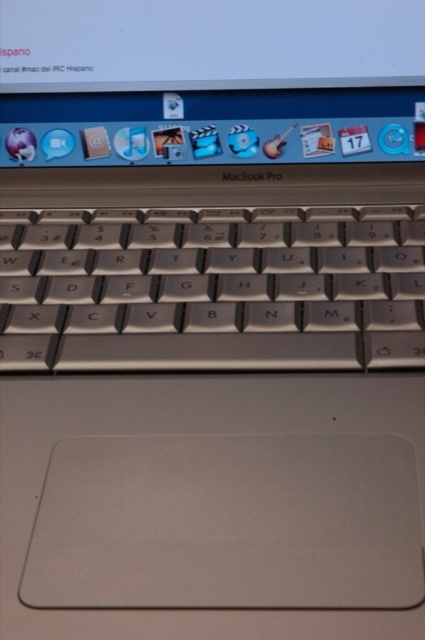
In the scene shown: You are a graphic designer working on a project and need to place a new icon on your MacBook Pro screen. The icon must be positioned exactly where the satin silver keyboard at center is located. Is this possible? Please explain using the coordinates provided in the scene.

The satin silver keyboard at center is located at coordinates point (x=214, y=289). Since the keyboard is a physical component of the laptop and the screen is a separate surface, you cannot place a digital icon on the keyboard itself. The icon would need to be placed on the screen area above the keyboard.

You are designing a desk layout and need to place a keyboard and a monitor. Given the image of the MacBook Pro, will the satin silver keyboard at center fit horizontally next to the white glossy screen at upper center if the desk space is exactly the same width as the screen?

The satin silver keyboard at center is narrower than the white glossy screen at upper center, so it will fit horizontally next to the screen if the desk space matches the screen width.

You are designing a desk layout and want to ensure there is enough vertical space between the satin silver keyboard at center and the white glossy screen at upper center. According to the image, which one is taller?

The satin silver keyboard at center is much taller than the white glossy screen at upper center.